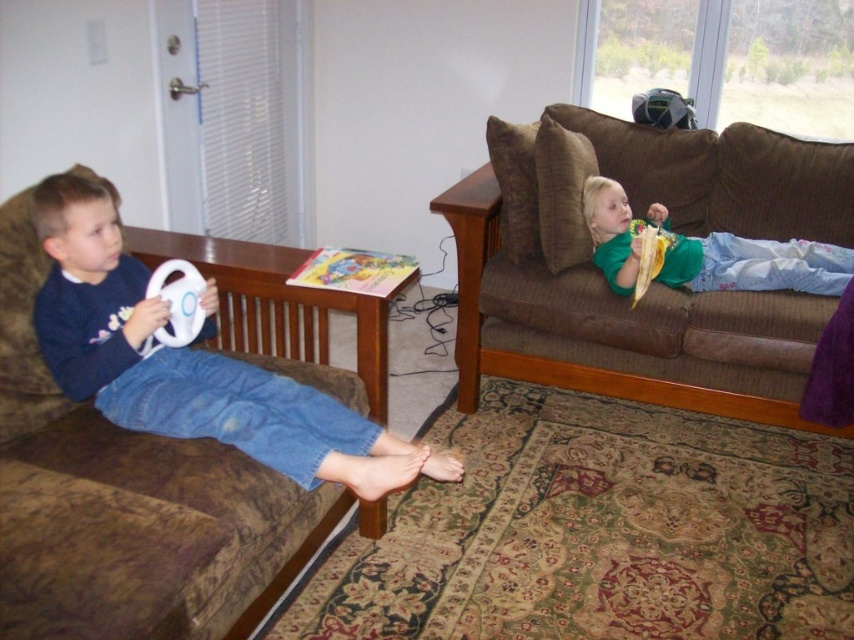
Question: Which object appears farthest from the camera in this image?

Choices:
 (A) brown fabric couch at left
 (B) green cotton shirt at upper right

Answer: (B)

Question: Does brown corduroy couch at right appear on the right side of green cotton shirt at upper right?

Choices:
 (A) yes
 (B) no

Answer: (B)

Question: Which object is positioned closest to the brown corduroy couch at right?

Choices:
 (A) brown fabric couch at left
 (B) white matte steering wheel at left

Answer: (A)

Question: Is brown fabric couch at left thinner than green cotton shirt at upper right?

Choices:
 (A) no
 (B) yes

Answer: (A)

Question: Is brown corduroy couch at right smaller than white matte steering wheel at left?

Choices:
 (A) yes
 (B) no

Answer: (B)

Question: Which object is farther from the camera taking this photo?

Choices:
 (A) white matte steering wheel at left
 (B) brown corduroy couch at right
 (C) green cotton shirt at upper right
 (D) brown fabric couch at left

Answer: (C)